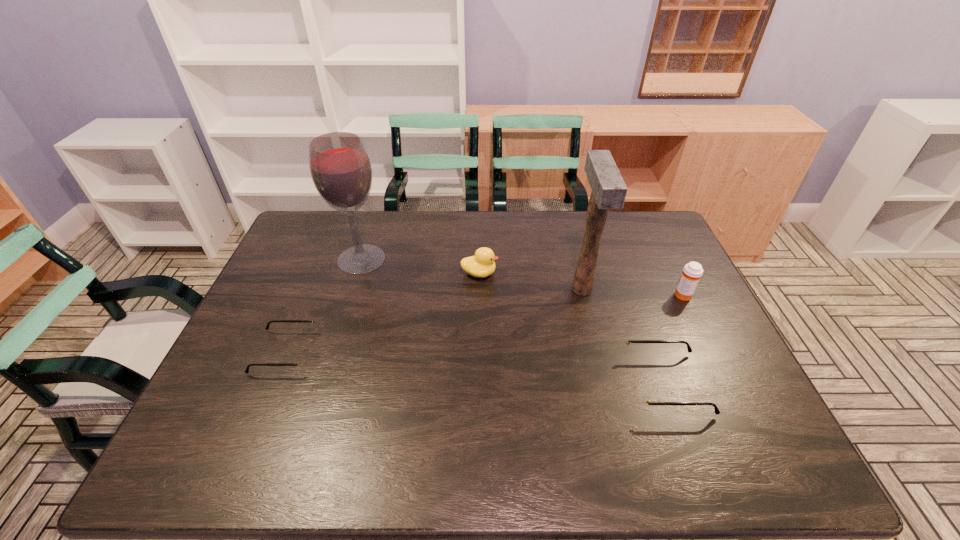
Where is `free spot between the alcohol and the shortest object`? This screenshot has height=540, width=960. free spot between the alcohol and the shortest object is located at coordinates (324, 306).

Locate an element on the screen. The height and width of the screenshot is (540, 960). empty space that is in between the alcohol and the rightmost object is located at coordinates (523, 277).

You are a GUI agent. You are given a task and a screenshot of the screen. Output one action in this format:
    pyautogui.click(x=<x>, y=<y>)
    Task: Click on the vacant area that lies between the duckling and the fourth object from left to right
    This screenshot has width=960, height=540.
    Given the screenshot: What is the action you would take?
    pyautogui.click(x=531, y=281)

The height and width of the screenshot is (540, 960). I want to click on empty location between the taller spectacles and the fourth shortest object, so click(x=675, y=339).

Identify the location of free space between the third tallest object and the fourth object from left to right. The image size is (960, 540). (633, 292).

In order to click on free space that is in between the duckling and the mallet in this screenshot , I will do `click(531, 281)`.

Image resolution: width=960 pixels, height=540 pixels. I want to click on free point between the right spectacles and the duckling, so click(572, 328).

Where is `object that is the closest to the alcohol`? This screenshot has width=960, height=540. object that is the closest to the alcohol is located at coordinates (303, 360).

Select which object is the second closest to the mallet. Please provide its 2D coordinates. Your answer should be formatted as a tuple, i.e. [(x, y)], where the tuple contains the x and y coordinates of a point satisfying the conditions above.

[(482, 264)]

Where is `free point that satisfies the following two spatial constraints: 1. on the beak of the third shortest object; 2. on the left side of the fourth object from left to right`? The width and height of the screenshot is (960, 540). free point that satisfies the following two spatial constraints: 1. on the beak of the third shortest object; 2. on the left side of the fourth object from left to right is located at coordinates (479, 289).